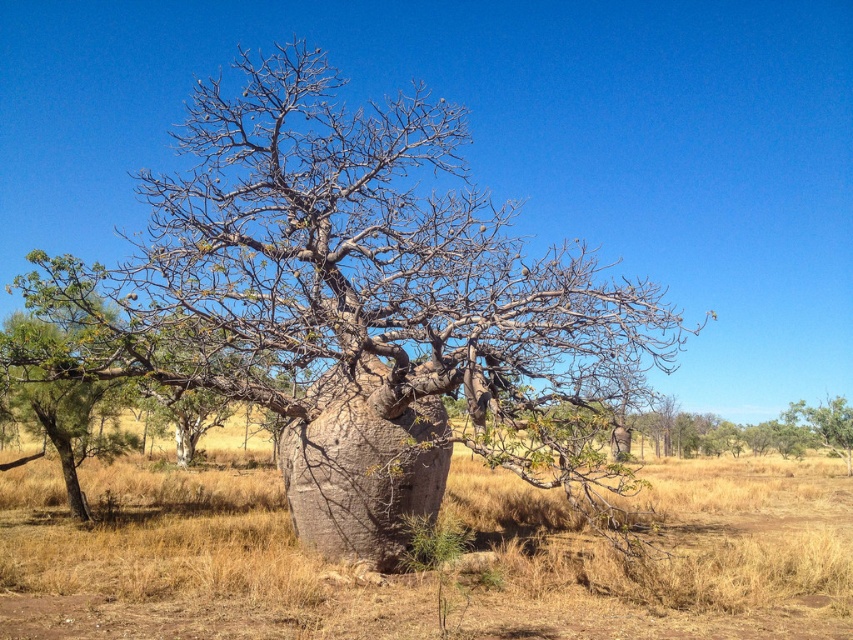
In the scene shown: Between gray textured tree at center and brown dry grass at center, which one appears on the left side from the viewer's perspective?

brown dry grass at center

Can you confirm if gray textured tree at center is thinner than brown dry grass at center?

Yes, gray textured tree at center is thinner than brown dry grass at center.

Identify the location of gray textured tree at center. (357, 308).

At what (x,y) coordinates should I click in order to perform the action: click on gray textured tree at center. Please return your answer as a coordinate pair (x, y). Image resolution: width=853 pixels, height=640 pixels. Looking at the image, I should click on (357, 308).